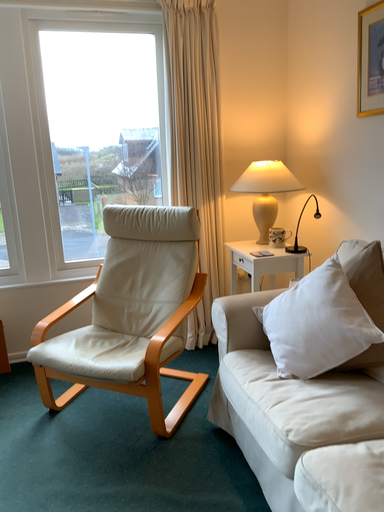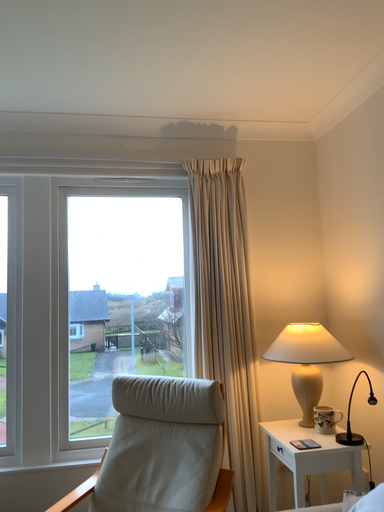
Question: How did the camera likely rotate when shooting the video?

Choices:
 (A) rotated downward
 (B) rotated upward

Answer: (B)